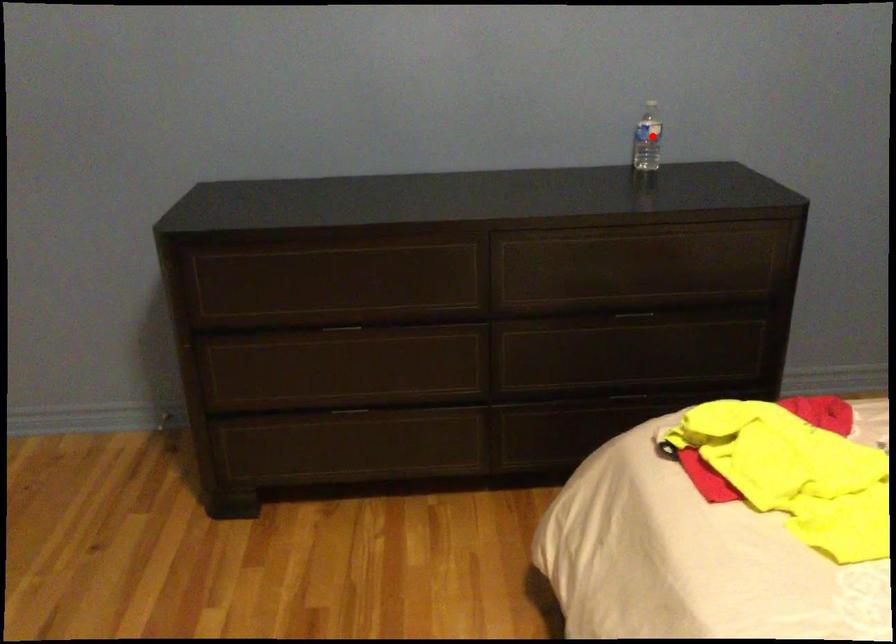
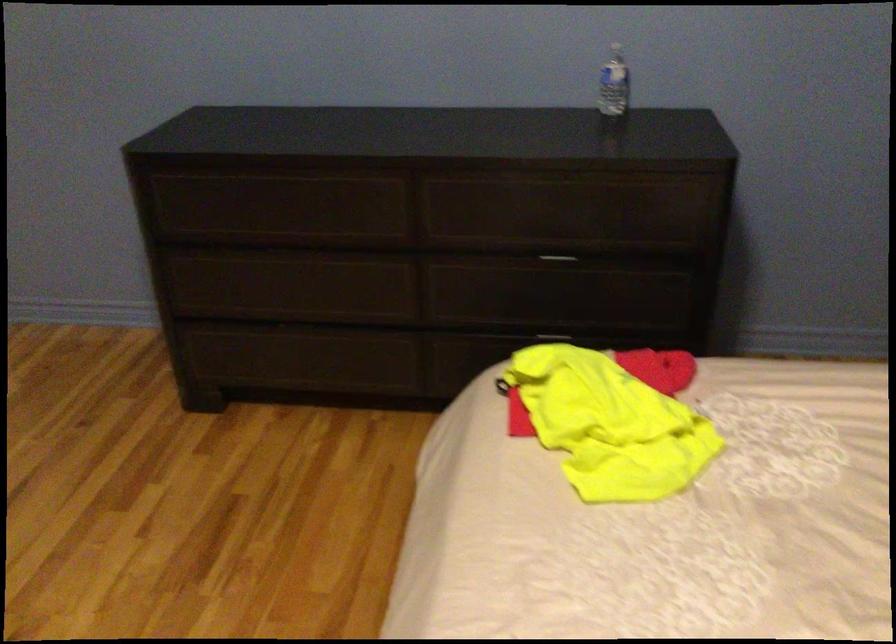
Locate, in the second image, the point that corresponds to the highlighted location in the first image.

(614, 84)